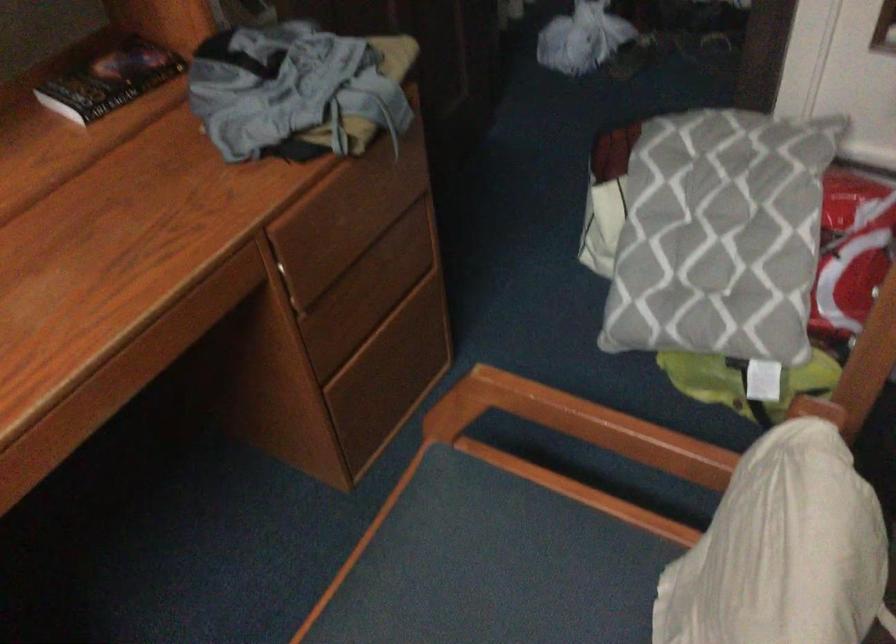
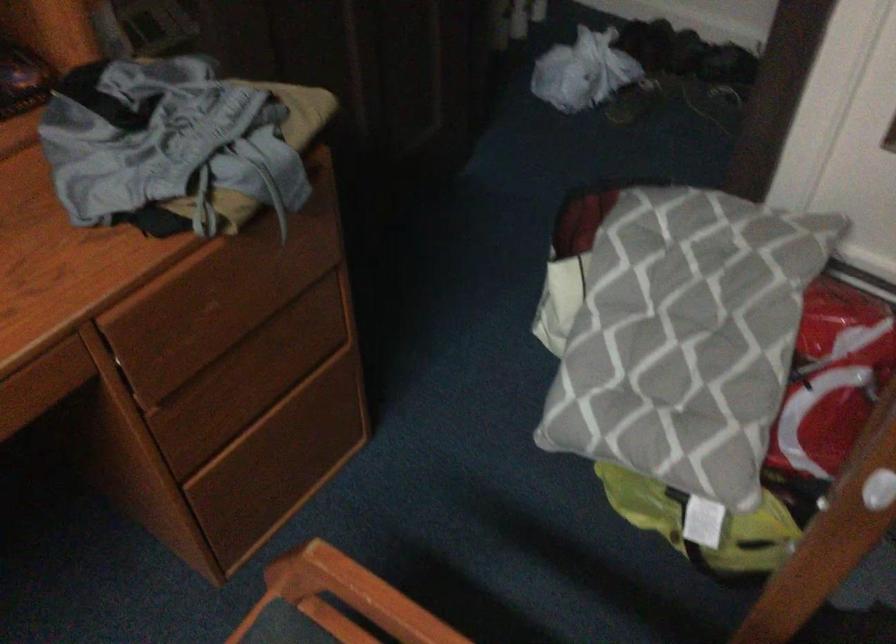
What movement of the cameraman would produce the second image?

The movement direction of the cameraman is right, forward.